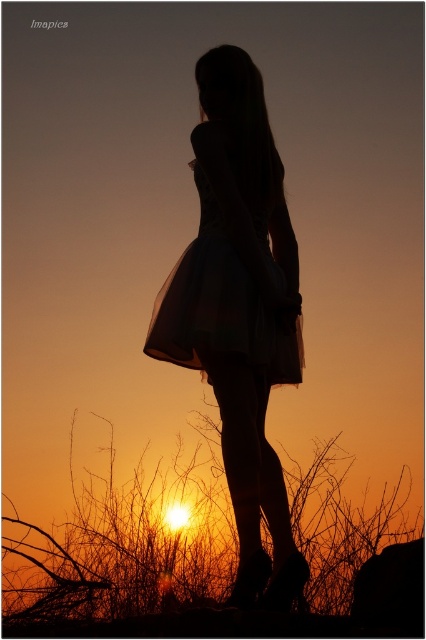
Question: Is silhouette dress at center smaller than translucent tulle dress at center?

Choices:
 (A) no
 (B) yes

Answer: (A)

Question: Is silhouette dress at center positioned in front of translucent tulle dress at center?

Choices:
 (A) yes
 (B) no

Answer: (A)

Question: From the image, what is the correct spatial relationship of silhouette dress at center in relation to translucent tulle dress at center?

Choices:
 (A) below
 (B) above

Answer: (A)

Question: Which point is closer to the camera?

Choices:
 (A) (204, 218)
 (B) (161, 324)

Answer: (B)